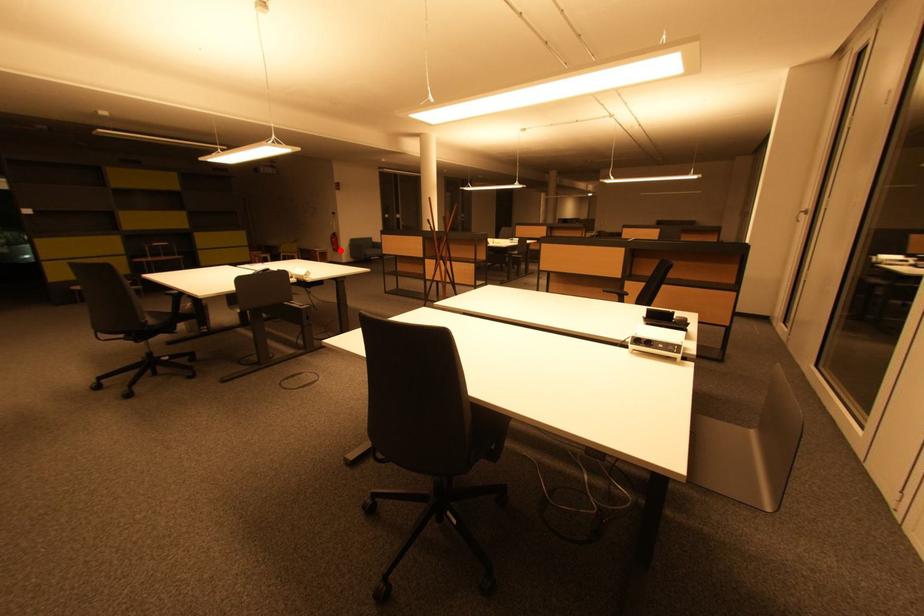
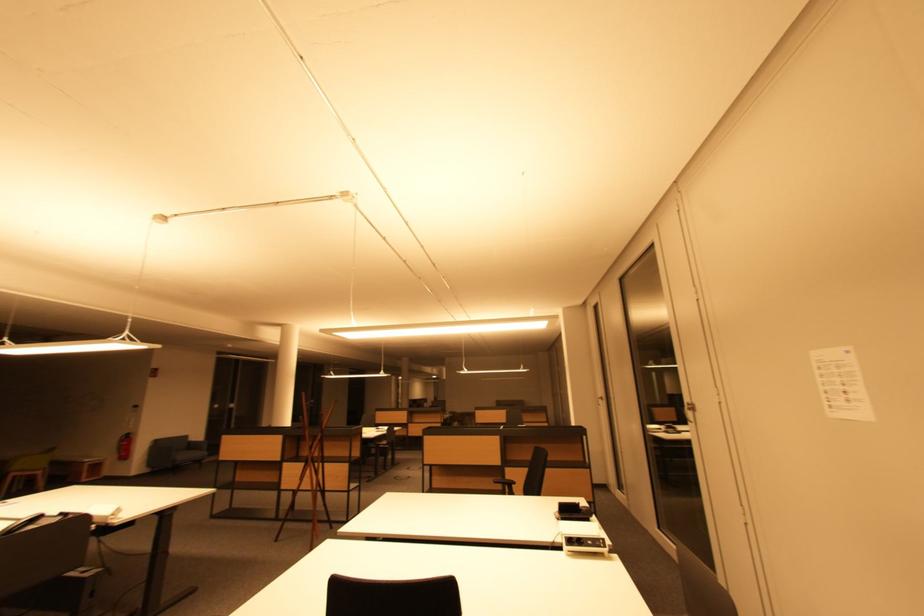
Find the pixel in the second image that matches the highlighted location in the first image.

(128, 458)